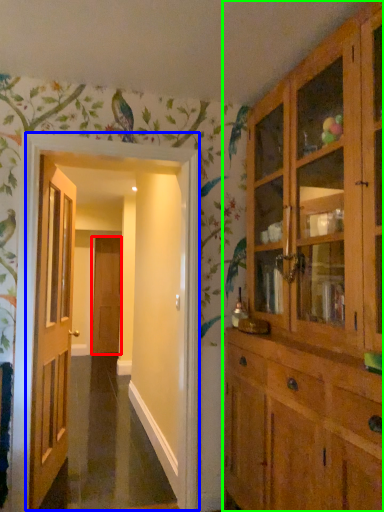
Question: Considering the real-world distances, which object is farthest from door (highlighted by a red box)? corridor (highlighted by a blue box) or cabinetry (highlighted by a green box)?

Choices:
 (A) corridor
 (B) cabinetry

Answer: (B)